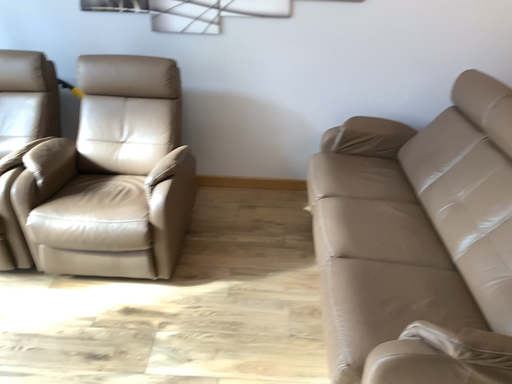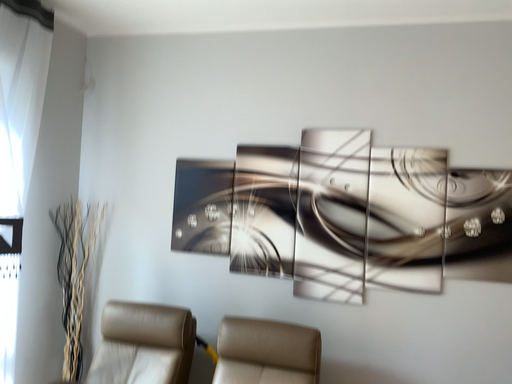
Question: How did the camera likely rotate when shooting the video?

Choices:
 (A) rotated left
 (B) rotated right

Answer: (A)